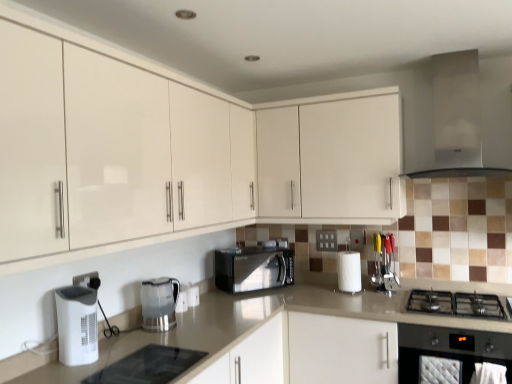
Image resolution: width=512 pixels, height=384 pixels. Find the location of `free space above black glass cooktop at lower center, positioned as the 1th appliance in left-to-right order (from a real-world perspective)`. free space above black glass cooktop at lower center, positioned as the 1th appliance in left-to-right order (from a real-world perspective) is located at coordinates (146, 360).